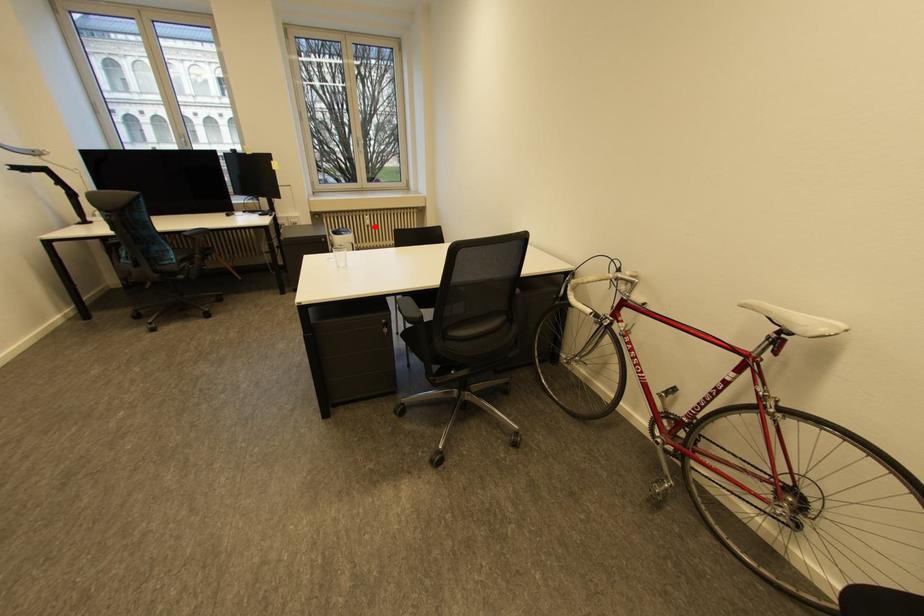
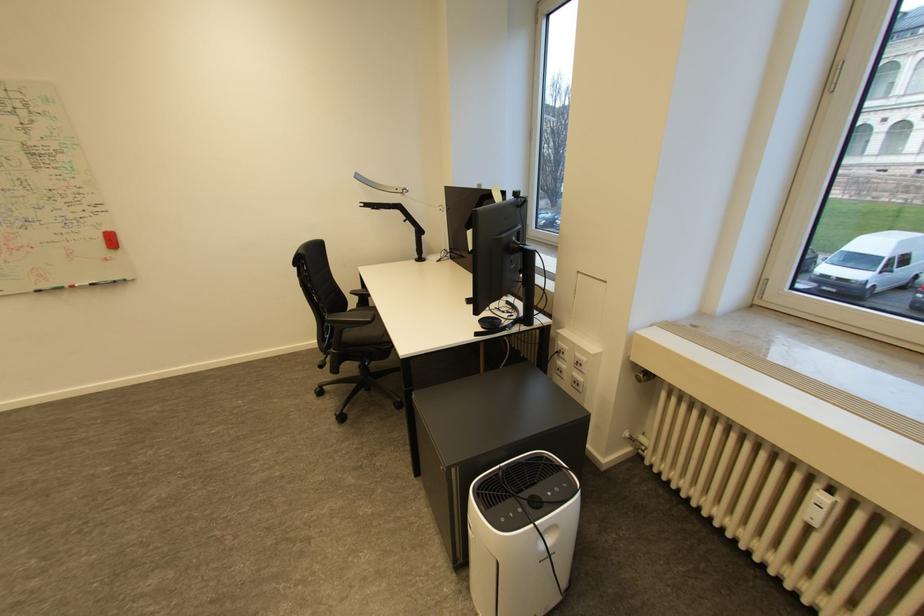
Question: I am providing you with two images of the same scene from different viewpoints. Image1 has a red point marked. In image2, the corresponding 3D location appears at what relative position? Reply with the corresponding letter.

Choices:
 (A) Closer
 (B) Farther

Answer: (A)